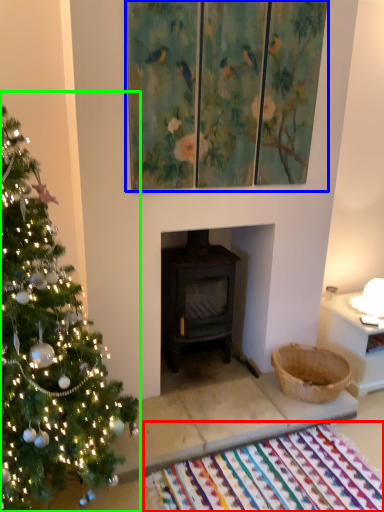
Question: Which object is the farthest from mat (highlighted by a red box)? Choose among these: picture frame (highlighted by a blue box) or christmas tree (highlighted by a green box).

Choices:
 (A) picture frame
 (B) christmas tree

Answer: (A)